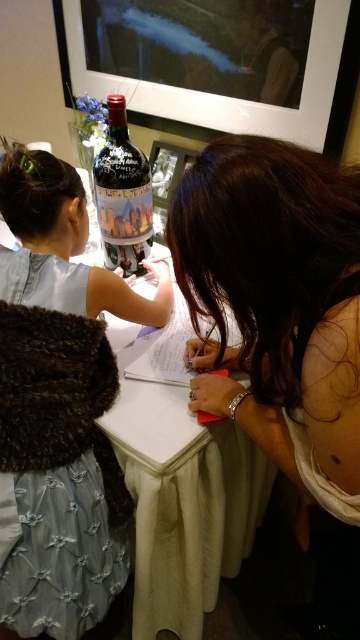
Does brown hair at upper center have a lesser width compared to light blue denim dress at lower left?

Yes, brown hair at upper center is thinner than light blue denim dress at lower left.

Measure the distance between brown hair at upper center and camera.

The distance of brown hair at upper center from camera is 19.73 inches.

Describe the element at coordinates (277, 304) in the screenshot. I see `brown hair at upper center` at that location.

What are the coordinates of `brown hair at upper center` in the screenshot? It's located at (277, 304).

Identify the location of light blue denim dress at lower left. The width and height of the screenshot is (360, 640). click(x=59, y=406).

Is point (61, 268) positioned after point (173, 493)?

No, it is in front of (173, 493).

Locate an element on the screen. The width and height of the screenshot is (360, 640). light blue denim dress at lower left is located at coordinates (59, 406).

Looking at this image, which of these two, light blue denim dress at lower left or matte glass bottle at center, stands taller?

Standing taller between the two is light blue denim dress at lower left.

From the picture: Between light blue denim dress at lower left and matte glass bottle at center, which one has less height?

With less height is matte glass bottle at center.

Which is in front, point (105, 563) or point (114, 188)?

Point (105, 563) is more forward.

Where is `light blue denim dress at lower left`? The height and width of the screenshot is (640, 360). light blue denim dress at lower left is located at coordinates (59, 406).